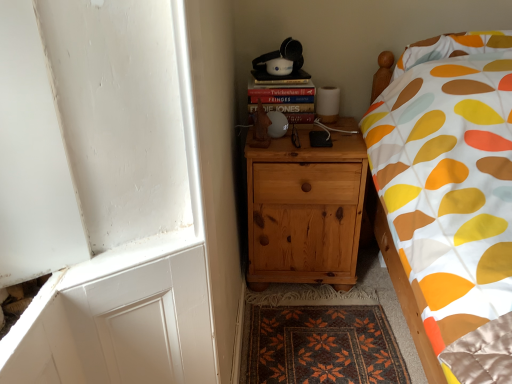
Image resolution: width=512 pixels, height=384 pixels. I want to click on blank space situated above dark brown woven mat at lower center (from a real-world perspective), so click(x=315, y=330).